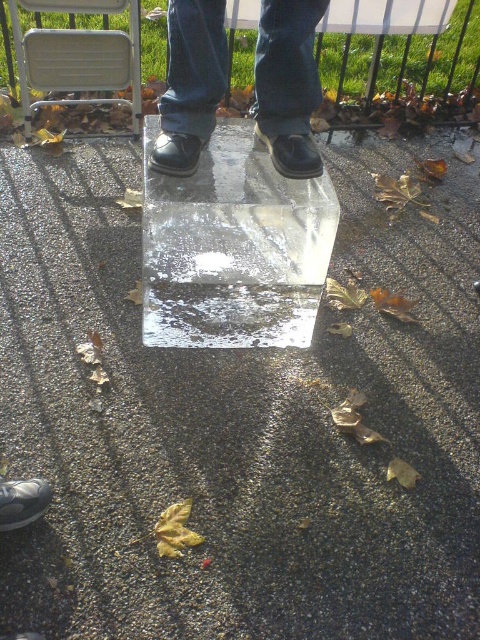
Question: Can you confirm if matte black shoes at center is bigger than metallic silver folding chair at upper left?

Choices:
 (A) no
 (B) yes

Answer: (A)

Question: Can you confirm if matte black shoes at center is positioned above metallic silver folding chair at upper left?

Choices:
 (A) no
 (B) yes

Answer: (A)

Question: Which object is closer to the camera taking this photo?

Choices:
 (A) matte black shoes at center
 (B) metallic silver folding chair at upper left

Answer: (A)

Question: Is matte black shoes at center smaller than metallic silver folding chair at upper left?

Choices:
 (A) no
 (B) yes

Answer: (B)